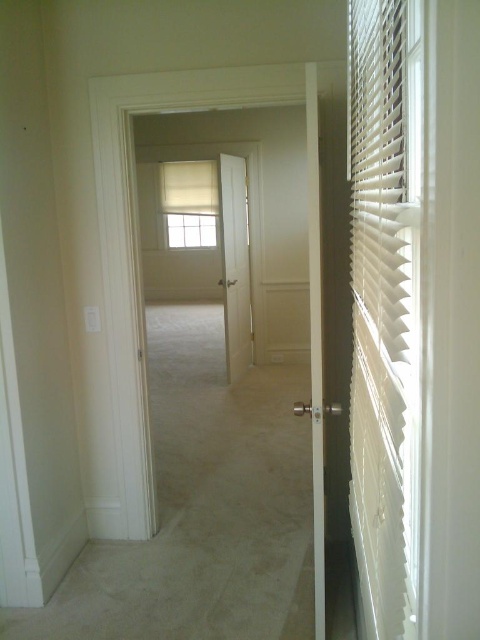
You are standing in the hallway and want to reach both the point at (x=405, y=323) and the point at (x=228, y=189). Which point should you reach first if you want to touch them in order from closest to farthest?

You should reach the point at (x=405, y=323) first because it is closer to you than the point at (x=228, y=189).

You are a delivery person holding a 30 inch wide package. You need to enter the room through the white plastic blinds at right. Can you fit the package through the opening without tilting it?

The white plastic blinds at right is 28.16 inches from viewer, so the package is wider than the opening. You cannot fit the package through the opening without tilting it.